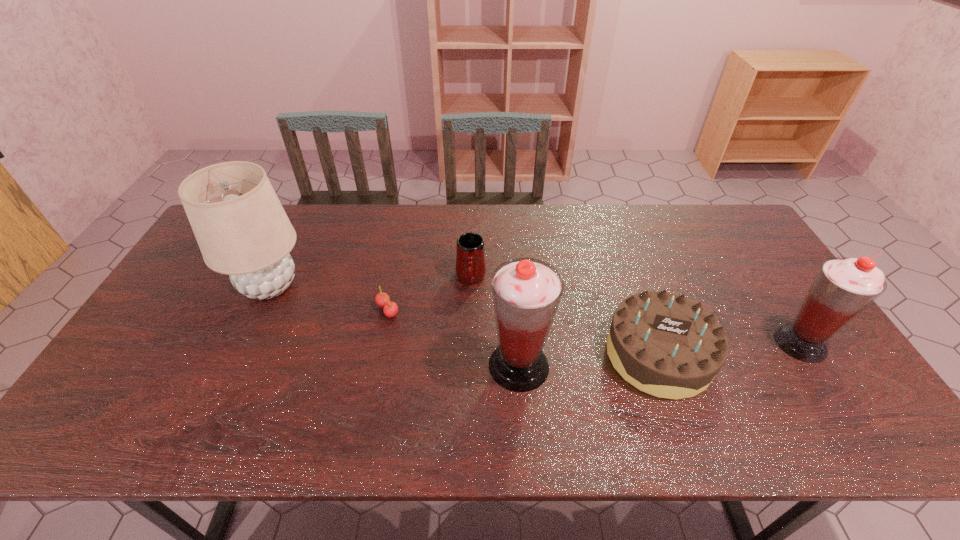
Where is `object that can be found as the third closest to the rightmost object`? object that can be found as the third closest to the rightmost object is located at coordinates (470, 253).

Point out which object is positioned as the fifth nearest to the leftmost object. Please provide its 2D coordinates. Your answer should be formatted as a tuple, i.e. [(x, y)], where the tuple contains the x and y coordinates of a point satisfying the conditions above.

[(843, 287)]

The width and height of the screenshot is (960, 540). I want to click on blank space that satisfies the following two spatial constraints: 1. on the side of the mug with the handle; 2. on the left side of the third tallest object, so click(469, 343).

I want to click on vacant space that satisfies the following two spatial constraints: 1. on the front side of the right smoothie; 2. on the left side of the cherry, so click(381, 343).